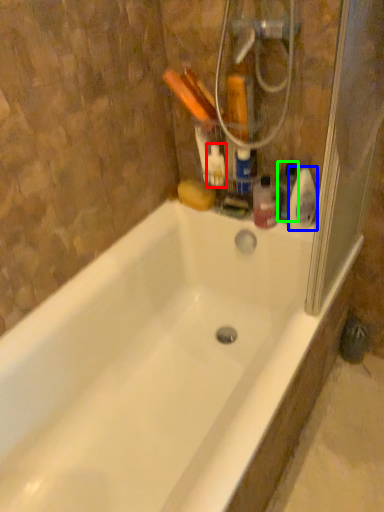
Question: Considering the real-world distances, which object is farthest from cleaning product (highlighted by a red box)? cleaning product (highlighted by a blue box) or cleaning product (highlighted by a green box)?

Choices:
 (A) cleaning product
 (B) cleaning product

Answer: (A)